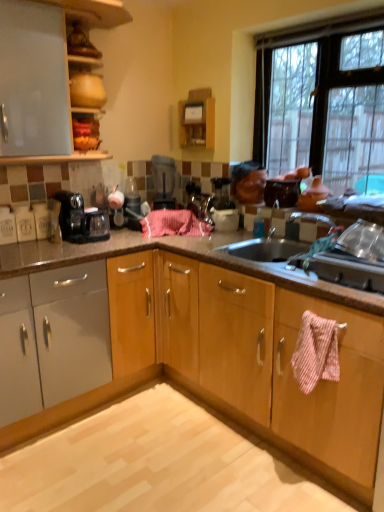
The width and height of the screenshot is (384, 512). Find the location of `free space above pink striped towel at lower right, acting as the 1th blanket starting from the right (from a real-world perspective)`. free space above pink striped towel at lower right, acting as the 1th blanket starting from the right (from a real-world perspective) is located at coordinates (317, 315).